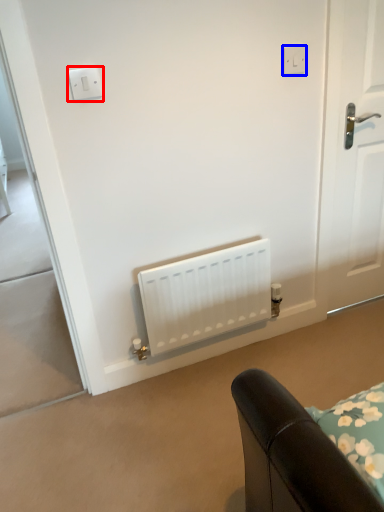
Question: Which point is further to the camera, light switch (highlighted by a red box) or electric outlet (highlighted by a blue box)?

Choices:
 (A) light switch
 (B) electric outlet

Answer: (B)